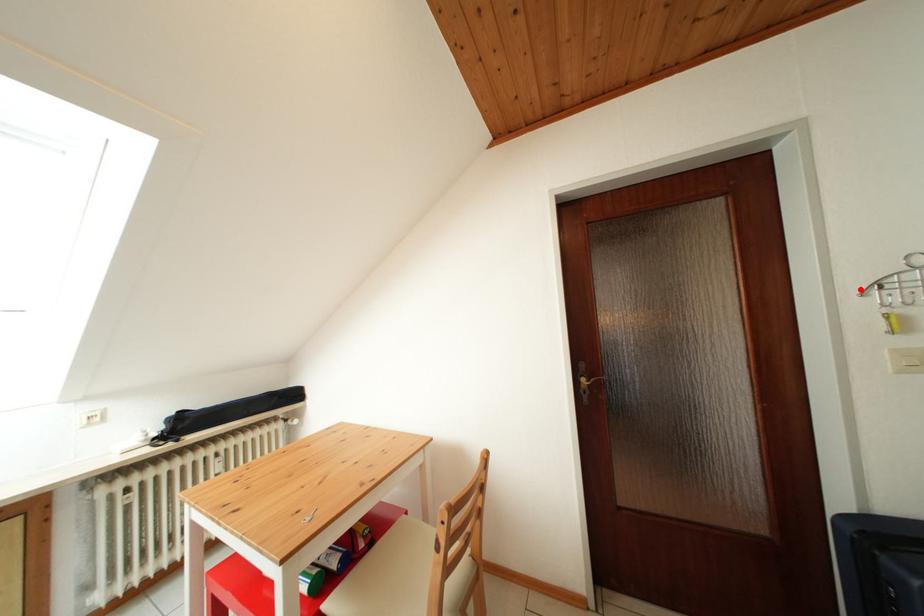
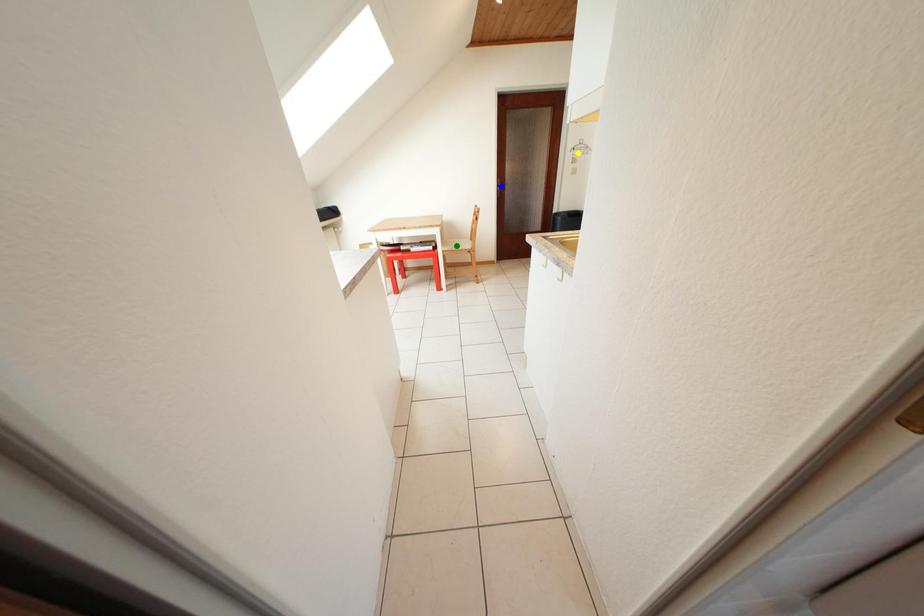
Question: I am providing you with two images of the same scene from different viewpoints. A red point is marked on the first image. You are given multiple points on the second image. In image 2, which mark is for the same physical point as the one in image 1?

Choices:
 (A) green point
 (B) blue point
 (C) yellow point

Answer: (C)